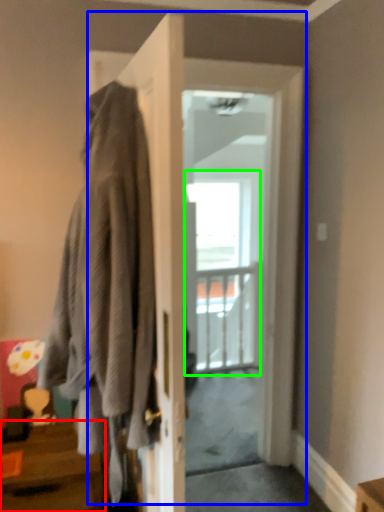
Question: Which is nearer to the table (highlighted by a red box)? door (highlighted by a blue box) or glass door (highlighted by a green box).

Choices:
 (A) door
 (B) glass door

Answer: (A)